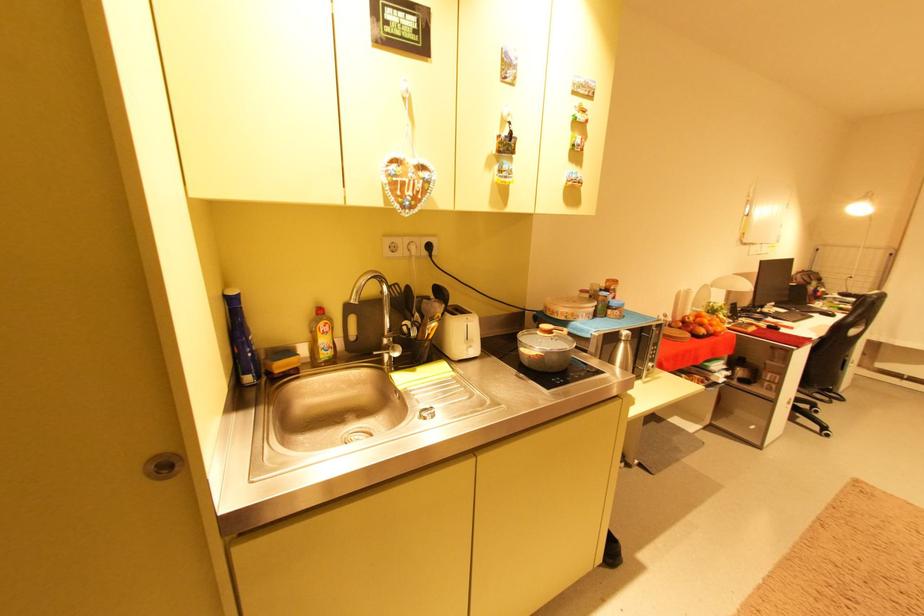
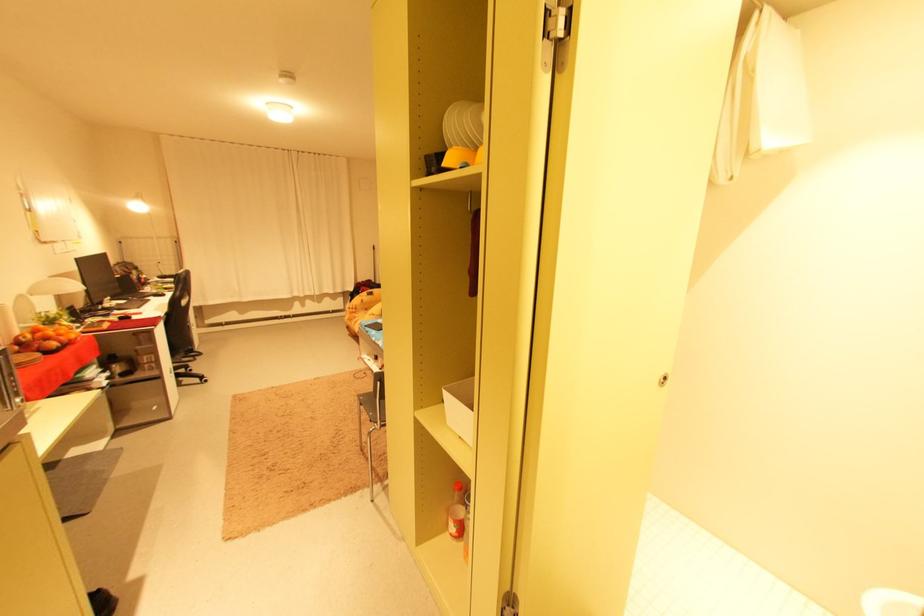
The point at (714,331) is marked in the first image. Where is the corresponding point in the second image?

(68, 344)